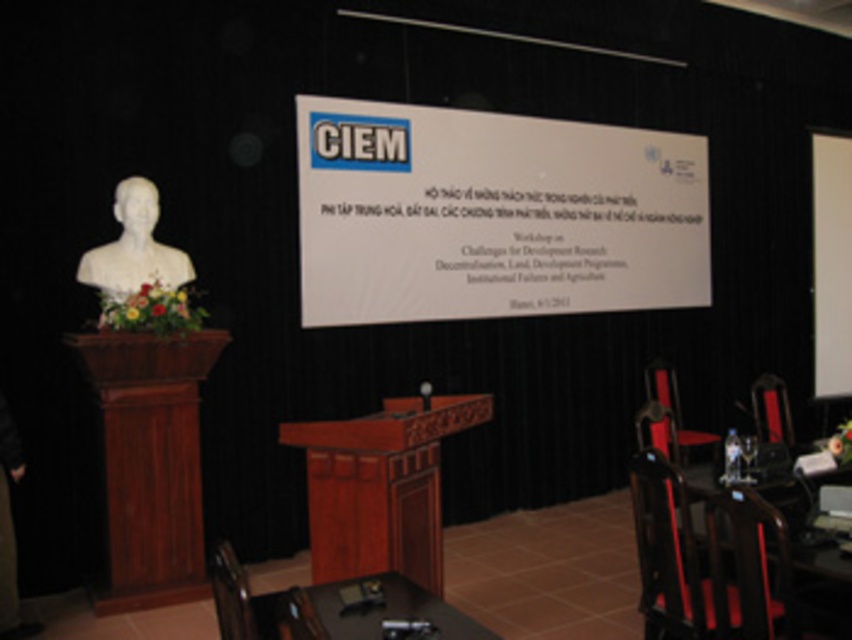
Question: Can you confirm if white matte projection screen at upper right is positioned to the right of wooden chair at lower left?

Choices:
 (A) no
 (B) yes

Answer: (B)

Question: Considering the real-world distances, which object is farthest from the wooden podium at center?

Choices:
 (A) white paper at center
 (B) wooden chair at lower left
 (C) matte black chair at right
 (D) white marble bust at left

Answer: (C)

Question: Is black wood table at lower center below white marble bust at left?

Choices:
 (A) yes
 (B) no

Answer: (A)

Question: Which point is farther to the camera?

Choices:
 (A) (776, 531)
 (B) (750, 403)
 (C) (112, 246)

Answer: (B)

Question: Among these points, which one is nearest to the camera?

Choices:
 (A) (839, 252)
 (B) (648, 392)

Answer: (B)

Question: From the image, what is the correct spatial relationship of wooden podium at center in relation to matte black chair at right?

Choices:
 (A) left
 (B) right

Answer: (A)